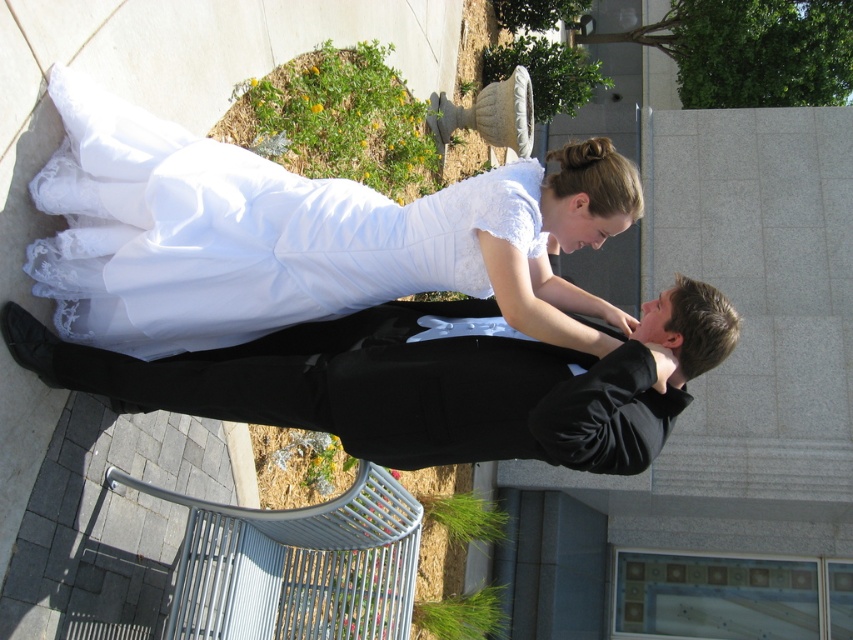
From the picture: You are a photographer at a wedding venue and need to capture a closeup shot of both the white satin dress at center and the black satin suit at center. The camera you are using has a maximum focus range of 40 centimeters. Will you be able to capture both subjects in focus without moving the camera?

The white satin dress at center and the black satin suit at center are 39.83 centimeters apart from each other. Since the distance between them is less than the camera maximum focus range of 40 centimeters, you can capture both subjects in focus without moving the camera.

You are a photographer at a wedding venue and need to position a bouquet at a specific point to frame the couple properly. The white satin dress at center is located at point (299,236). Where should you place the bouquet?

The bouquet should be placed at the point (299,236) where the white satin dress at center is located to frame the couple properly.